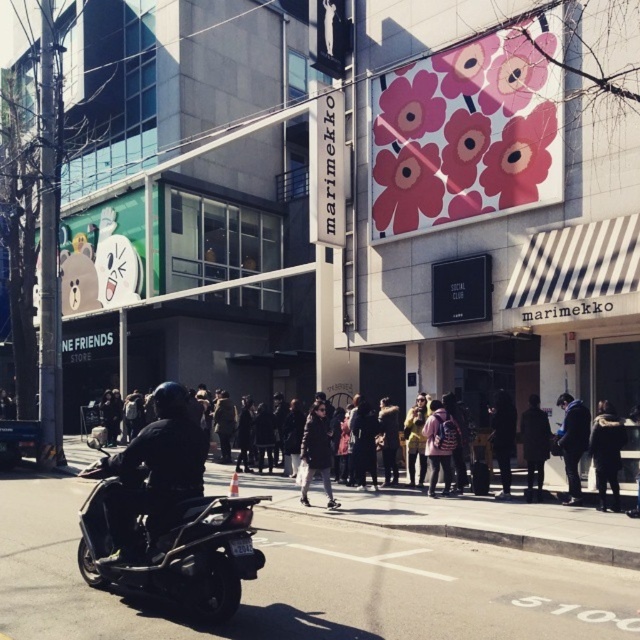
Can you confirm if black matte scooter at lower left is thinner than dark gray jacket at center?

No.

Who is more forward, (148, 513) or (301, 456)?

Point (148, 513)

Between point (108, 483) and point (308, 424), which one is positioned behind?

Positioned behind is point (308, 424).

Locate an element on the screen. The height and width of the screenshot is (640, 640). black matte scooter at lower left is located at coordinates (168, 541).

Is black matte scooter at lower left closer to camera compared to dark blue helmet at center?

Yes, it is in front of dark blue helmet at center.

Is black matte scooter at lower left below dark blue helmet at center?

Actually, black matte scooter at lower left is above dark blue helmet at center.

Who is more distant from viewer, (189,561) or (116,554)?

Positioned behind is point (116,554).

Identify the location of black matte scooter at lower left. Image resolution: width=640 pixels, height=640 pixels. (168, 541).

Measure the distance between black matte scooter at lower left and dark fabric coat at center.

8.70 meters

Is black matte scooter at lower left positioned at the back of dark fabric coat at center?

No, black matte scooter at lower left is closer to the viewer.

Which is in front, point (208, 604) or point (532, 451)?

Point (208, 604)

Identify the location of black matte scooter at lower left. Image resolution: width=640 pixels, height=640 pixels. pos(168,541).